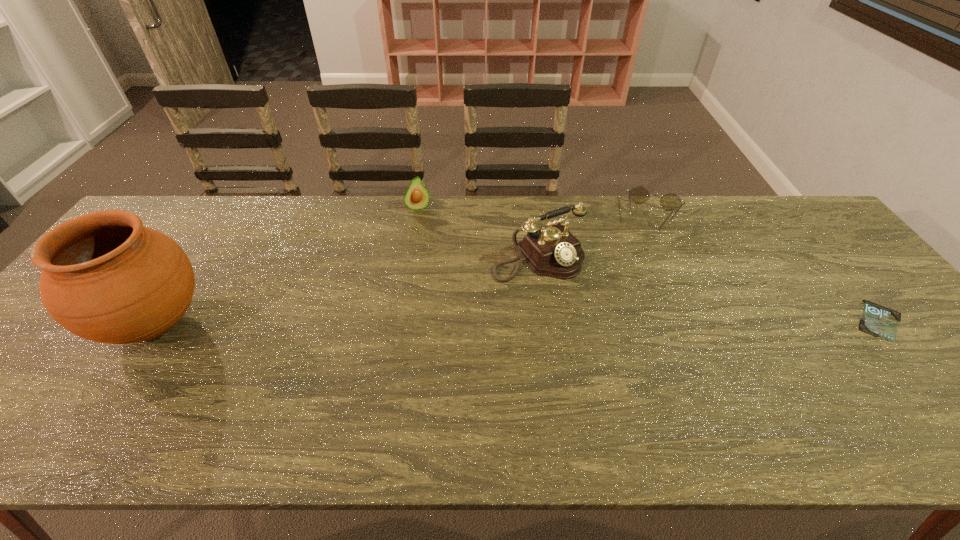
Where is `vacant space situated 0.110m on the front-facing side of the second object from right to left`? This screenshot has height=540, width=960. vacant space situated 0.110m on the front-facing side of the second object from right to left is located at coordinates (642, 254).

The image size is (960, 540). What are the coordinates of `avocado that is at the far edge` in the screenshot? It's located at (416, 197).

The height and width of the screenshot is (540, 960). Identify the location of telephone present at the far edge. click(x=554, y=251).

Image resolution: width=960 pixels, height=540 pixels. I want to click on spectacles at the far edge, so click(x=639, y=194).

You are a GUI agent. You are given a task and a screenshot of the screen. Output one action in this format:
    pyautogui.click(x=<x>, y=<y>)
    Task: Click on the object that is at the left edge
    
    Given the screenshot: What is the action you would take?
    pyautogui.click(x=105, y=277)

The height and width of the screenshot is (540, 960). What are the coordinates of `object situated at the right edge` in the screenshot? It's located at (879, 321).

Find the location of `vacant region at the far edge`. vacant region at the far edge is located at coordinates (445, 237).

At what (x,y) coordinates should I click in order to perform the action: click on free point at the near edge. Please return your answer as a coordinate pair (x, y). The width and height of the screenshot is (960, 540). Looking at the image, I should click on (96, 401).

Image resolution: width=960 pixels, height=540 pixels. Find the location of `free space at the right edge of the desktop`. free space at the right edge of the desktop is located at coordinates (831, 287).

Identify the location of free region at the near left corner of the desktop. The image size is (960, 540). click(44, 400).